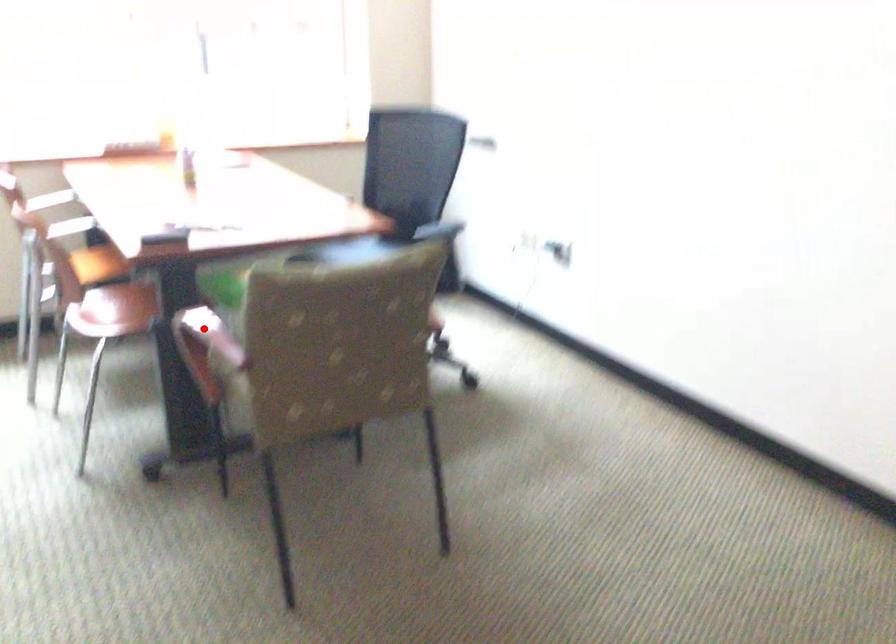
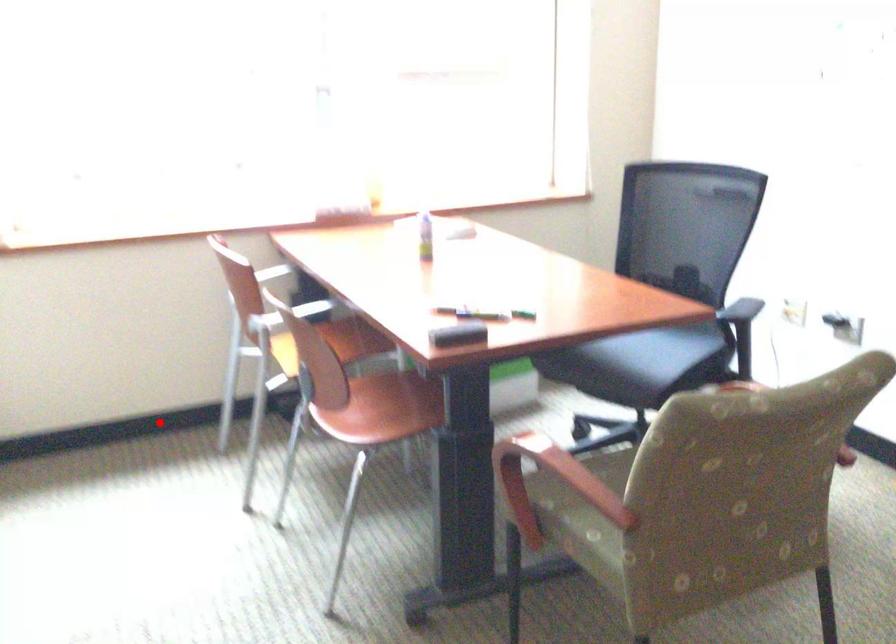
I am providing you with two images of the same scene from different viewpoints. A red point is marked on the first image and another point is marked on the second image. Are the points marked in image1 and image2 representing the same 3D position?

No